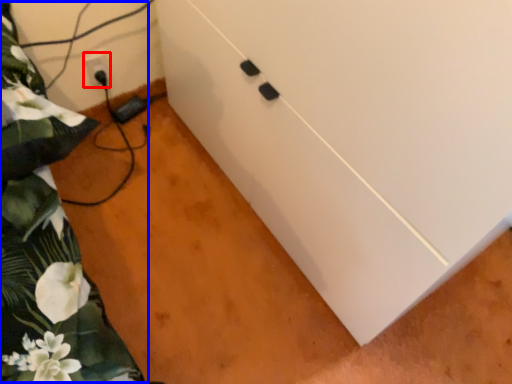
Question: Which of the following is the farthest to the observer, electric outlet (highlighted by a red box) or bed (highlighted by a blue box)?

Choices:
 (A) electric outlet
 (B) bed

Answer: (A)